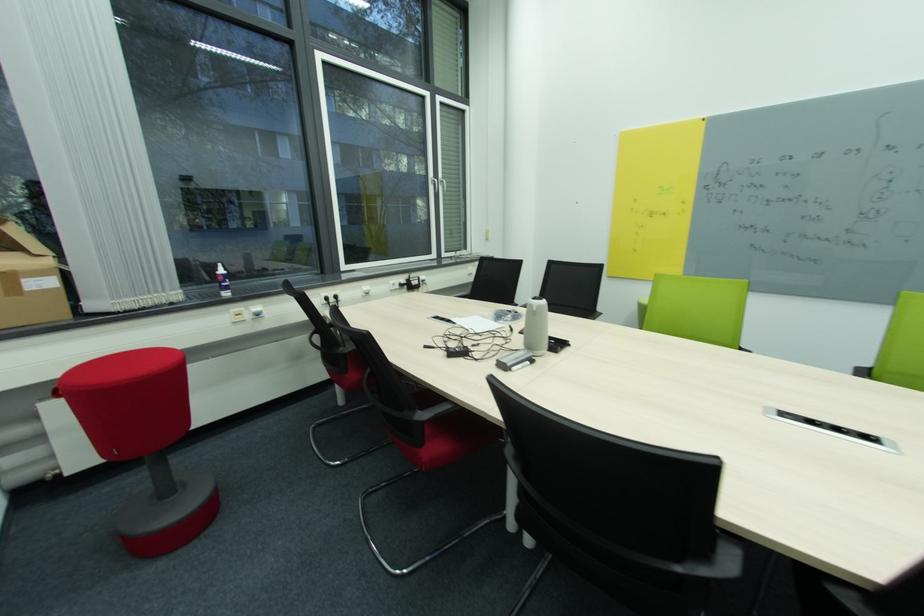
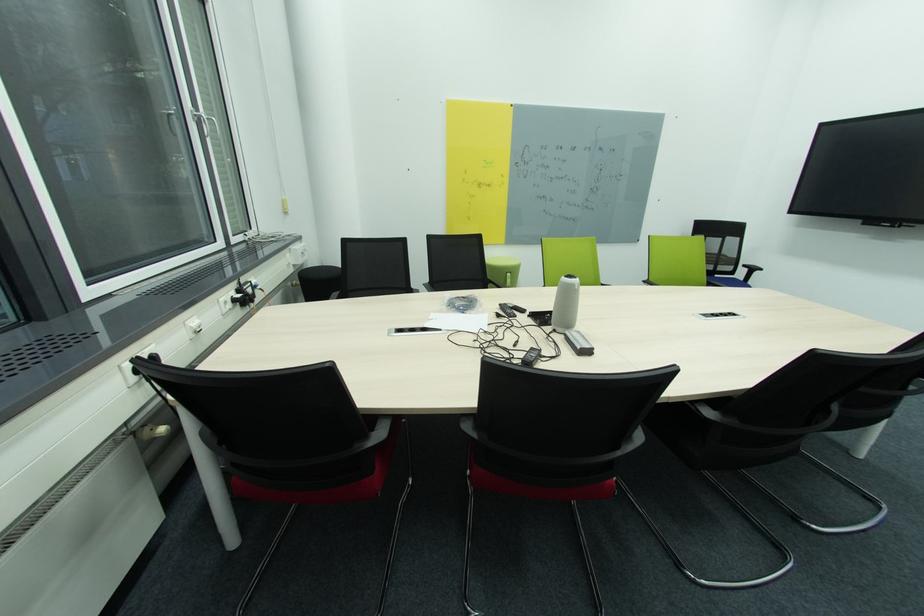
Find the pixel in the second image that matches [489,317] in the first image.

(444, 313)